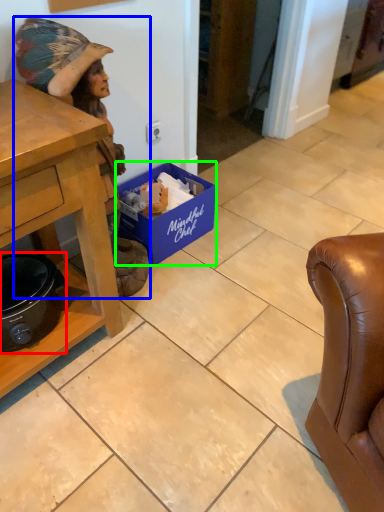
Question: Which object is positioned farthest from appliance (highlighted by a red box)? Select from person (highlighted by a blue box) and box (highlighted by a green box).

Choices:
 (A) person
 (B) box

Answer: (B)